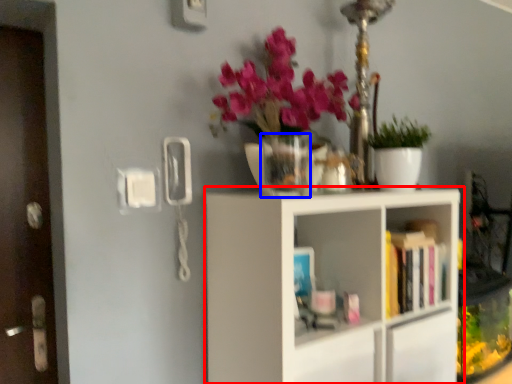
Question: Which object is further to the camera taking this photo, shelf (highlighted by a red box) or vase (highlighted by a blue box)?

Choices:
 (A) shelf
 (B) vase

Answer: (B)